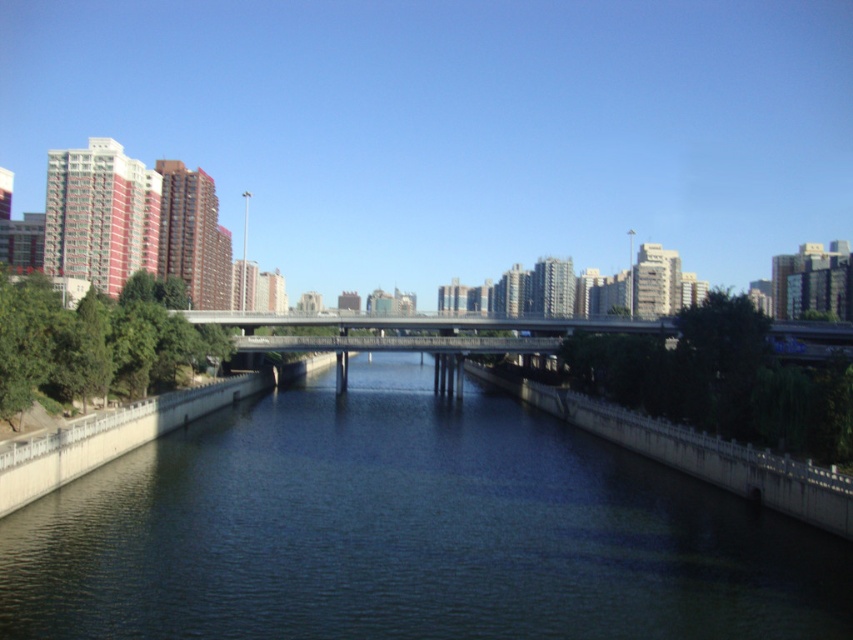
You are planning to cross the river using a small boat that can only handle a 5 meter width. Based on the scene, will the dark blue concrete river at center be narrower than the metallic gray bridge at center?

The dark blue concrete river at center has a lesser width compared to the metallic gray bridge at center, so yes, the river is narrower than the bridge, meaning the boat can safely cross the river since it is narrower than the bridge.

You are a city planner assessing the space between the dark blue concrete river at center and the metallic gray bridge at center. Which object takes up less space in the image?

The dark blue concrete river at center takes up less space than the metallic gray bridge at center, as it is smaller in size according to the description.